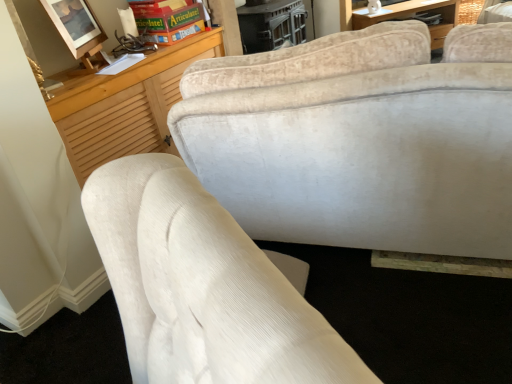
Question: Is green cardboard game at upper center positioned beyond the bounds of matte wooden picture frame at upper left?

Choices:
 (A) no
 (B) yes

Answer: (B)

Question: Is green cardboard game at upper center further to camera compared to matte wooden picture frame at upper left?

Choices:
 (A) no
 (B) yes

Answer: (B)

Question: Is green cardboard game at upper center bigger than matte wooden picture frame at upper left?

Choices:
 (A) yes
 (B) no

Answer: (A)

Question: Considering the relative sizes of green cardboard game at upper center and matte wooden picture frame at upper left in the image provided, is green cardboard game at upper center shorter than matte wooden picture frame at upper left?

Choices:
 (A) yes
 (B) no

Answer: (A)

Question: Is green cardboard game at upper center positioned before matte wooden picture frame at upper left?

Choices:
 (A) no
 (B) yes

Answer: (A)

Question: Is green cardboard game at upper center not close to matte wooden picture frame at upper left?

Choices:
 (A) yes
 (B) no

Answer: (B)

Question: From a real-world perspective, is matte wooden picture frame at upper left on top of green cardboard game at upper center?

Choices:
 (A) no
 (B) yes

Answer: (B)

Question: Is matte wooden picture frame at upper left at the left side of green cardboard game at upper center?

Choices:
 (A) no
 (B) yes

Answer: (B)

Question: Is green cardboard game at upper center surrounded by matte wooden picture frame at upper left?

Choices:
 (A) yes
 (B) no

Answer: (B)

Question: Is matte wooden picture frame at upper left closer to camera compared to green cardboard game at upper center?

Choices:
 (A) no
 (B) yes

Answer: (B)

Question: Can you confirm if matte wooden picture frame at upper left is smaller than green cardboard game at upper center?

Choices:
 (A) yes
 (B) no

Answer: (A)

Question: Considering the relative sizes of matte wooden picture frame at upper left and green cardboard game at upper center in the image provided, is matte wooden picture frame at upper left shorter than green cardboard game at upper center?

Choices:
 (A) no
 (B) yes

Answer: (A)

Question: Choose the correct answer: Is green cardboard game at upper center inside matte wooden picture frame at upper left or outside it?

Choices:
 (A) inside
 (B) outside

Answer: (B)